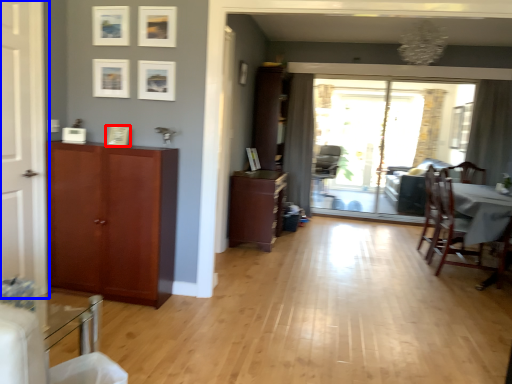
Question: Which point is closer to the camera, picture frame (highlighted by a red box) or door (highlighted by a blue box)?

Choices:
 (A) picture frame
 (B) door

Answer: (B)